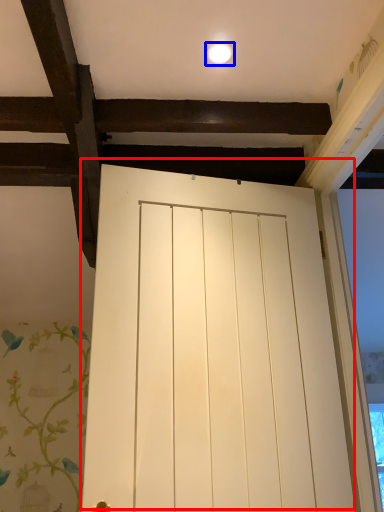
Question: Which object is further to the camera taking this photo, door (highlighted by a red box) or lighting (highlighted by a blue box)?

Choices:
 (A) door
 (B) lighting

Answer: (B)